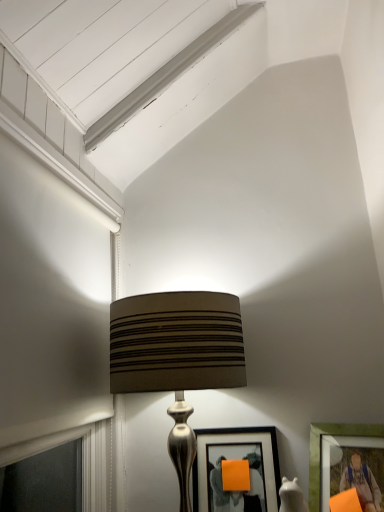
Locate an element on the screen. This screenshot has height=512, width=384. matte black picture frame at center, the first picture frame when ordered from left to right is located at coordinates (237, 463).

The width and height of the screenshot is (384, 512). What do you see at coordinates (320, 451) in the screenshot? I see `matte green picture frame at lower right, which is the 1th picture frame from right to left` at bounding box center [320, 451].

Image resolution: width=384 pixels, height=512 pixels. Identify the location of matte brown fabric lampshade at center. (177, 356).

The image size is (384, 512). I want to click on matte black picture frame at center, the first picture frame when ordered from left to right, so click(x=237, y=463).

Is point (129, 316) closer to camera compared to point (197, 459)?

Yes.

From a real-world perspective, is matte brown fabric lampshade at center above or below matte black picture frame at center, acting as the second picture frame starting from the right?

Clearly, from a real-world perspective, matte brown fabric lampshade at center is above matte black picture frame at center, acting as the second picture frame starting from the right.

Which is behind, matte brown fabric lampshade at center or matte black picture frame at center, the first picture frame when ordered from left to right?

matte black picture frame at center, the first picture frame when ordered from left to right.

Is matte brown fabric lampshade at center inside the boundaries of matte black picture frame at center, acting as the second picture frame starting from the right, or outside?

matte brown fabric lampshade at center cannot be found inside matte black picture frame at center, acting as the second picture frame starting from the right.

Is matte green picture frame at lower right, which is the 1th picture frame from right to left, smaller than matte brown fabric lampshade at center?

Yes, matte green picture frame at lower right, which is the 1th picture frame from right to left, is smaller than matte brown fabric lampshade at center.

From a real-world perspective, is matte green picture frame at lower right, which is the 1th picture frame from right to left, above or below matte brown fabric lampshade at center?

From a real-world perspective, matte green picture frame at lower right, which is the 1th picture frame from right to left, is physically below matte brown fabric lampshade at center.

Locate an element on the screen. This screenshot has width=384, height=512. lamp in front of the matte green picture frame at lower right, which is the 1th picture frame from right to left is located at coordinates (177, 356).

Considering the points (357, 430) and (163, 344), which point is behind, point (357, 430) or point (163, 344)?

The point (357, 430) is behind.

Which of these two, matte black picture frame at center, acting as the second picture frame starting from the right, or matte green picture frame at lower right, the 2th picture frame viewed from the left, stands taller?

With more height is matte black picture frame at center, acting as the second picture frame starting from the right.

Measure the distance from matte black picture frame at center, the first picture frame when ordered from left to right, to matte green picture frame at lower right, which is the 1th picture frame from right to left.

matte black picture frame at center, the first picture frame when ordered from left to right, and matte green picture frame at lower right, which is the 1th picture frame from right to left, are 7.33 inches apart.

Which is closer, (x=270, y=467) or (x=325, y=423)?

Point (x=270, y=467)

From the image's perspective, who appears lower, matte black picture frame at center, acting as the second picture frame starting from the right, or matte green picture frame at lower right, which is the 1th picture frame from right to left?

matte black picture frame at center, acting as the second picture frame starting from the right, from the image's perspective.

Based on the photo, which object is thinner, matte brown fabric lampshade at center or matte green picture frame at lower right, which is the 1th picture frame from right to left?

matte green picture frame at lower right, which is the 1th picture frame from right to left.

Are matte brown fabric lampshade at center and matte green picture frame at lower right, the 2th picture frame viewed from the left, beside each other?

No, matte brown fabric lampshade at center is not with matte green picture frame at lower right, the 2th picture frame viewed from the left.

From a real-world perspective, which object stands above the other?

matte brown fabric lampshade at center is physically above.

Is matte brown fabric lampshade at center bigger or smaller than matte green picture frame at lower right, which is the 1th picture frame from right to left?

matte brown fabric lampshade at center is bigger than matte green picture frame at lower right, which is the 1th picture frame from right to left.

Is matte black picture frame at center, acting as the second picture frame starting from the right, positioned beyond the bounds of matte brown fabric lampshade at center?

No, matte black picture frame at center, acting as the second picture frame starting from the right, is inside or overlapping with matte brown fabric lampshade at center.

Is matte black picture frame at center, the first picture frame when ordered from left to right, at the left side of matte brown fabric lampshade at center?

No, matte black picture frame at center, the first picture frame when ordered from left to right, is not to the left of matte brown fabric lampshade at center.

Measure the distance between matte black picture frame at center, the first picture frame when ordered from left to right, and matte brown fabric lampshade at center.

10.99 inches.

Consider the image. Is matte green picture frame at lower right, which is the 1th picture frame from right to left, aimed at matte black picture frame at center, acting as the second picture frame starting from the right?

No, matte green picture frame at lower right, which is the 1th picture frame from right to left, is not aimed at matte black picture frame at center, acting as the second picture frame starting from the right.

Looking at their sizes, would you say matte green picture frame at lower right, which is the 1th picture frame from right to left, is wider or thinner than matte black picture frame at center, the first picture frame when ordered from left to right?

In the image, matte green picture frame at lower right, which is the 1th picture frame from right to left, appears to be wider than matte black picture frame at center, the first picture frame when ordered from left to right.

Between matte green picture frame at lower right, which is the 1th picture frame from right to left, and matte black picture frame at center, acting as the second picture frame starting from the right, which one appears on the right side from the viewer's perspective?

matte green picture frame at lower right, which is the 1th picture frame from right to left.

From the image's perspective, is matte green picture frame at lower right, the 2th picture frame viewed from the left, positioned above or below matte black picture frame at center, the first picture frame when ordered from left to right?

matte green picture frame at lower right, the 2th picture frame viewed from the left, is above matte black picture frame at center, the first picture frame when ordered from left to right.

I want to click on lamp above the matte black picture frame at center, the first picture frame when ordered from left to right (from a real-world perspective), so click(x=177, y=356).

Where is `picture frame that is the 2nd one when counting rightward from the matte brown fabric lampshade at center`? This screenshot has height=512, width=384. picture frame that is the 2nd one when counting rightward from the matte brown fabric lampshade at center is located at coordinates (320, 451).

Considering their positions, is matte brown fabric lampshade at center positioned closer to matte black picture frame at center, the first picture frame when ordered from left to right, than matte green picture frame at lower right, the 2th picture frame viewed from the left?

Among the two, matte green picture frame at lower right, the 2th picture frame viewed from the left, is located nearer to matte black picture frame at center, the first picture frame when ordered from left to right.

Looking at this image, looking at the image, which one is located closer to matte green picture frame at lower right, the 2th picture frame viewed from the left, matte black picture frame at center, the first picture frame when ordered from left to right, or matte brown fabric lampshade at center?

matte black picture frame at center, the first picture frame when ordered from left to right, lies closer to matte green picture frame at lower right, the 2th picture frame viewed from the left, than the other object.

Based on their spatial positions, is matte black picture frame at center, the first picture frame when ordered from left to right, or matte green picture frame at lower right, which is the 1th picture frame from right to left, further from matte brown fabric lampshade at center?

matte green picture frame at lower right, which is the 1th picture frame from right to left.

When comparing their distances from matte green picture frame at lower right, which is the 1th picture frame from right to left, does matte brown fabric lampshade at center or matte black picture frame at center, acting as the second picture frame starting from the right, seem closer?

Among the two, matte black picture frame at center, acting as the second picture frame starting from the right, is located nearer to matte green picture frame at lower right, which is the 1th picture frame from right to left.

Based on their spatial positions, is matte green picture frame at lower right, which is the 1th picture frame from right to left, or matte brown fabric lampshade at center further from matte black picture frame at center, acting as the second picture frame starting from the right?

Based on the image, matte brown fabric lampshade at center appears to be further to matte black picture frame at center, acting as the second picture frame starting from the right.

Based on their spatial positions, is matte green picture frame at lower right, the 2th picture frame viewed from the left, or matte black picture frame at center, acting as the second picture frame starting from the right, closer to matte brown fabric lampshade at center?

The object closer to matte brown fabric lampshade at center is matte black picture frame at center, acting as the second picture frame starting from the right.

Find the location of a particular element. This screenshot has width=384, height=512. picture frame located between matte brown fabric lampshade at center and matte green picture frame at lower right, which is the 1th picture frame from right to left, in the left-right direction is located at coordinates (237, 463).